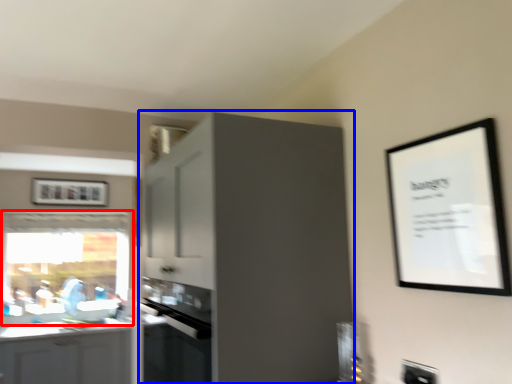
Question: Which object is closer to the camera taking this photo, window (highlighted by a red box) or cabinetry (highlighted by a blue box)?

Choices:
 (A) window
 (B) cabinetry

Answer: (B)